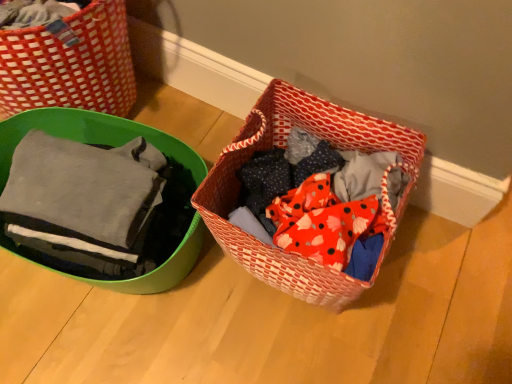
This screenshot has width=512, height=384. I want to click on vacant space in front of red woven basket at center, the 1th picnic basket in the right-to-left sequence, so click(296, 337).